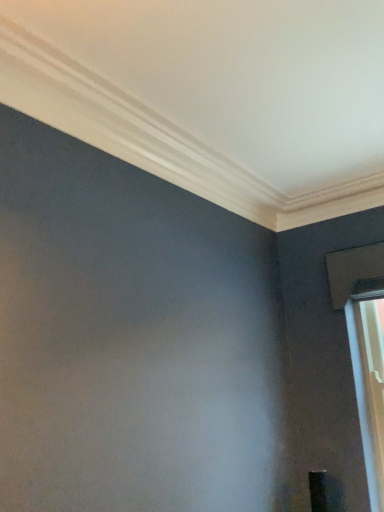
Question: Should I look upward or downward to see clear glass window at right?

Choices:
 (A) down
 (B) up

Answer: (A)